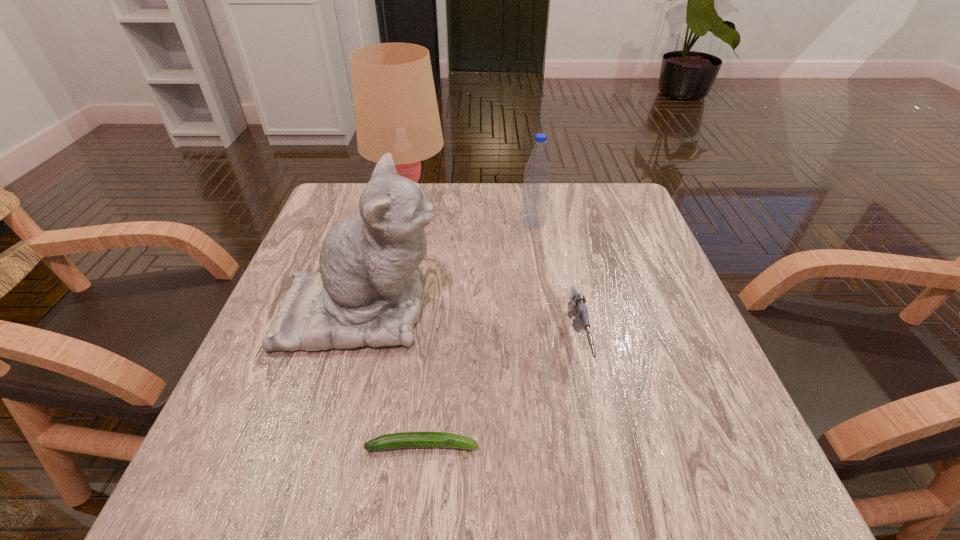
In order to click on free point between the zucchini and the water bottle in this screenshot , I will do `click(477, 333)`.

I want to click on vacant space in between the nearest object and the fourth shortest object, so click(x=392, y=377).

This screenshot has height=540, width=960. I want to click on vacant area between the fourth object from left to right and the gun, so click(x=555, y=284).

The height and width of the screenshot is (540, 960). In order to click on empty location between the lampshade and the fourth object from left to right in this screenshot , I will do `click(470, 213)`.

I want to click on the fourth closest object to the cat, so click(576, 306).

Identify the location of object that is the third closest to the cat. (535, 192).

Locate an element on the screen. Image resolution: width=960 pixels, height=540 pixels. blank space that satisfies the following two spatial constraints: 1. at the barrel of the rightmost object; 2. on the front-facing side of the nearest object is located at coordinates (597, 445).

The image size is (960, 540). I want to click on vacant space that satisfies the following two spatial constraints: 1. on the front side of the third tallest object; 2. on the front-facing side of the zucchini, so [567, 445].

The image size is (960, 540). What are the coordinates of `free location that satisfies the following two spatial constraints: 1. at the barrel of the rightmost object; 2. on the front-facing side of the nearest object` in the screenshot? It's located at (597, 445).